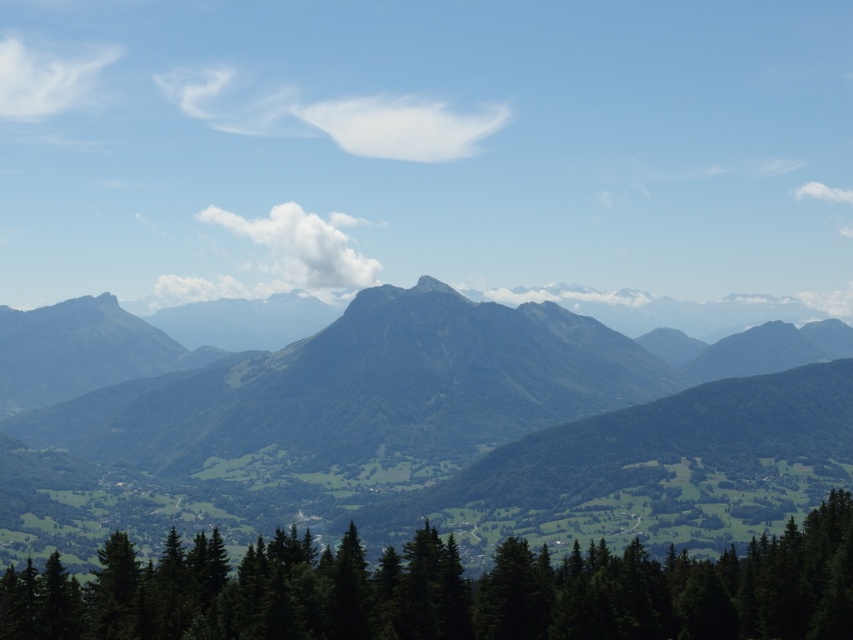
Question: Among these objects, which one is nearest to the camera?

Choices:
 (A) green textured mountain at center
 (B) green matte trees at bottom

Answer: (B)

Question: Which object appears farthest from the camera in this image?

Choices:
 (A) green matte trees at bottom
 (B) green textured mountain at center

Answer: (B)

Question: Does green textured mountain at center appear on the right side of green matte trees at bottom?

Choices:
 (A) yes
 (B) no

Answer: (B)

Question: Does green textured mountain at center appear under green matte trees at bottom?

Choices:
 (A) no
 (B) yes

Answer: (A)

Question: Does green textured mountain at center have a lesser width compared to green matte trees at bottom?

Choices:
 (A) yes
 (B) no

Answer: (B)